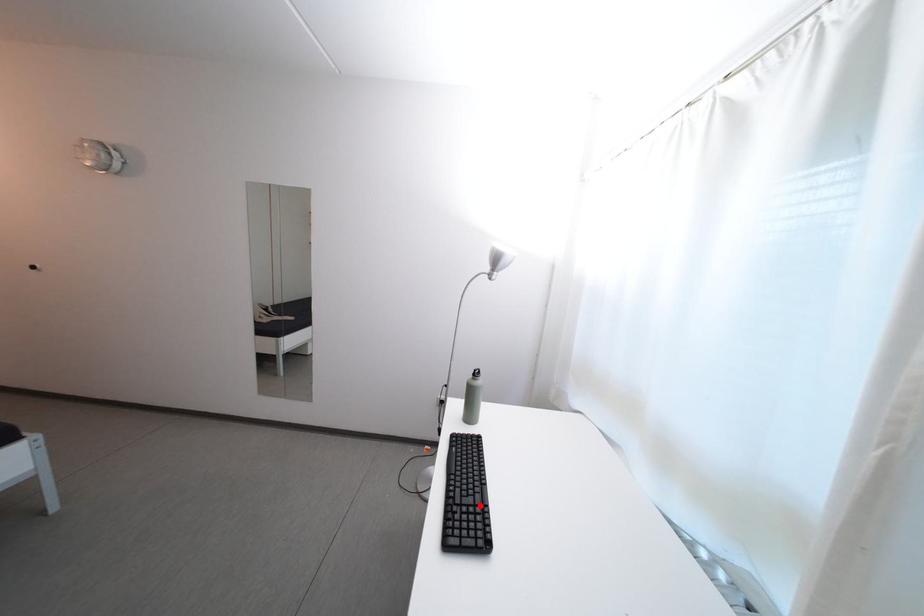
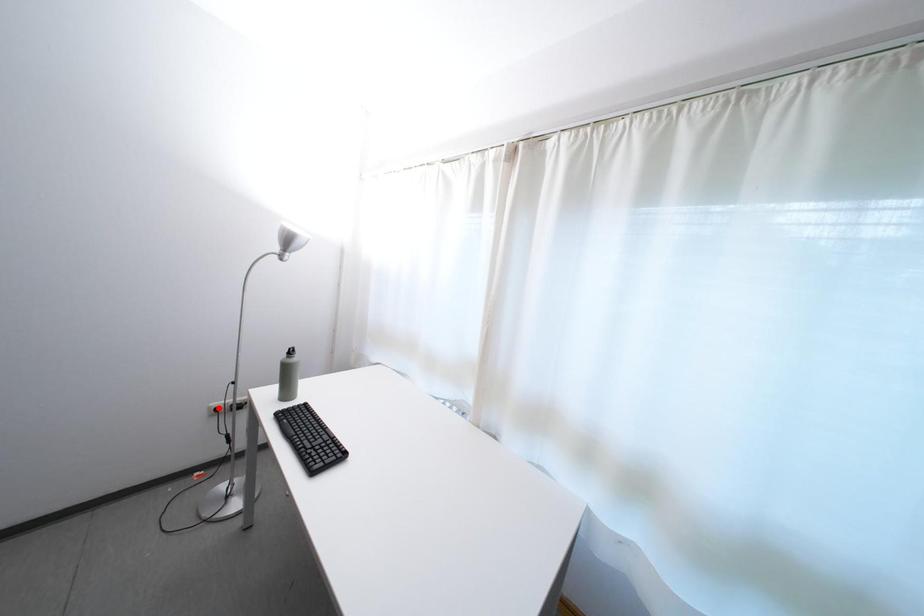
I am providing you with two images of the same scene from different viewpoints. A red point is marked on the first image and another point is marked on the second image. Is the red point in image1 aligned with the point shown in image2?

No